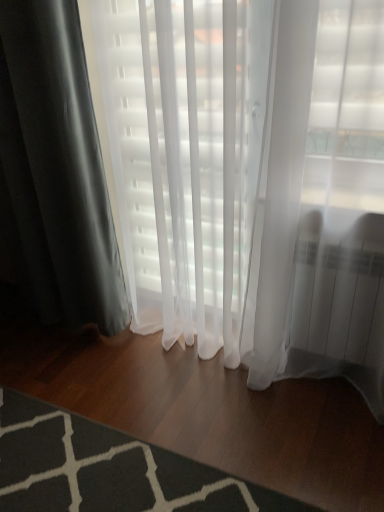
Question: Can you confirm if dark gray textured rug at lower left is smaller than matte black curtain at left?

Choices:
 (A) no
 (B) yes

Answer: (B)

Question: Is dark gray textured rug at lower left thinner than matte black curtain at left?

Choices:
 (A) yes
 (B) no

Answer: (B)

Question: Is dark gray textured rug at lower left to the left of matte black curtain at left from the viewer's perspective?

Choices:
 (A) yes
 (B) no

Answer: (B)

Question: Would you say dark gray textured rug at lower left is outside matte black curtain at left?

Choices:
 (A) yes
 (B) no

Answer: (A)

Question: Is dark gray textured rug at lower left at the right side of matte black curtain at left?

Choices:
 (A) yes
 (B) no

Answer: (A)

Question: Is matte black curtain at left a part of dark gray textured rug at lower left?

Choices:
 (A) yes
 (B) no

Answer: (B)

Question: Is matte black curtain at left facing away from dark gray textured rug at lower left?

Choices:
 (A) yes
 (B) no

Answer: (B)

Question: Does matte black curtain at left have a lesser width compared to dark gray textured rug at lower left?

Choices:
 (A) yes
 (B) no

Answer: (A)

Question: Can you confirm if matte black curtain at left is taller than dark gray textured rug at lower left?

Choices:
 (A) yes
 (B) no

Answer: (A)

Question: Can you confirm if matte black curtain at left is wider than dark gray textured rug at lower left?

Choices:
 (A) yes
 (B) no

Answer: (B)

Question: From the image's perspective, would you say matte black curtain at left is positioned over dark gray textured rug at lower left?

Choices:
 (A) yes
 (B) no

Answer: (A)

Question: Considering the relative sizes of matte black curtain at left and dark gray textured rug at lower left in the image provided, is matte black curtain at left shorter than dark gray textured rug at lower left?

Choices:
 (A) yes
 (B) no

Answer: (B)

Question: Looking at their shapes, would you say matte black curtain at left is wider or thinner than dark gray textured rug at lower left?

Choices:
 (A) wide
 (B) thin

Answer: (B)